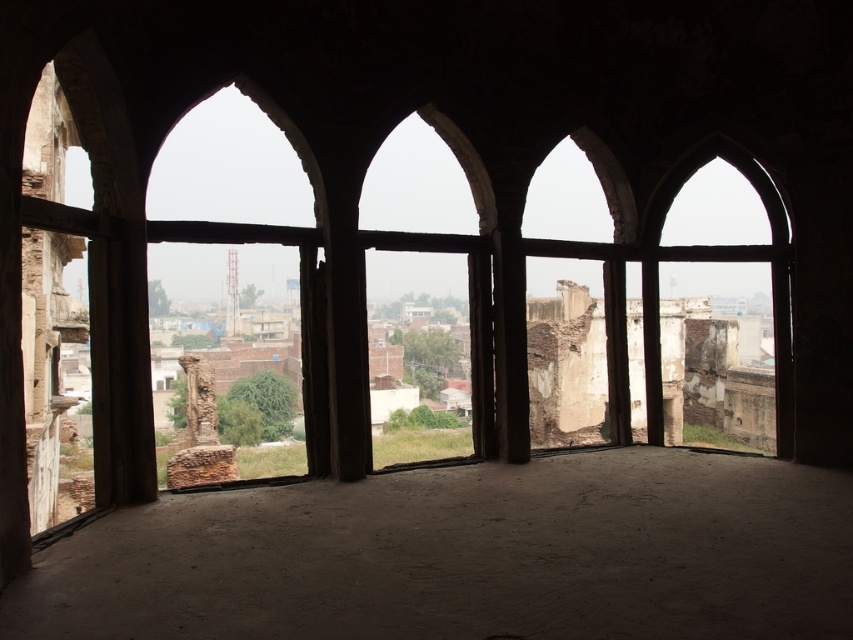
Question: Which point is farther to the camera?

Choices:
 (A) (399, 193)
 (B) (297, 252)
 (C) (788, 412)

Answer: (A)

Question: Does matte stone window at center appear on the left side of matte stone window at right?

Choices:
 (A) yes
 (B) no

Answer: (A)

Question: Which object is farther from the camera taking this photo?

Choices:
 (A) matte stone window at left
 (B) matte stone window at right

Answer: (B)

Question: Is matte stone window at left behind matte stone window at right?

Choices:
 (A) yes
 (B) no

Answer: (B)

Question: Which of the following is the farthest from the observer?

Choices:
 (A) matte stone window at right
 (B) matte stone window at left

Answer: (A)

Question: Does matte stone window at center appear on the left side of matte stone window at right?

Choices:
 (A) no
 (B) yes

Answer: (B)